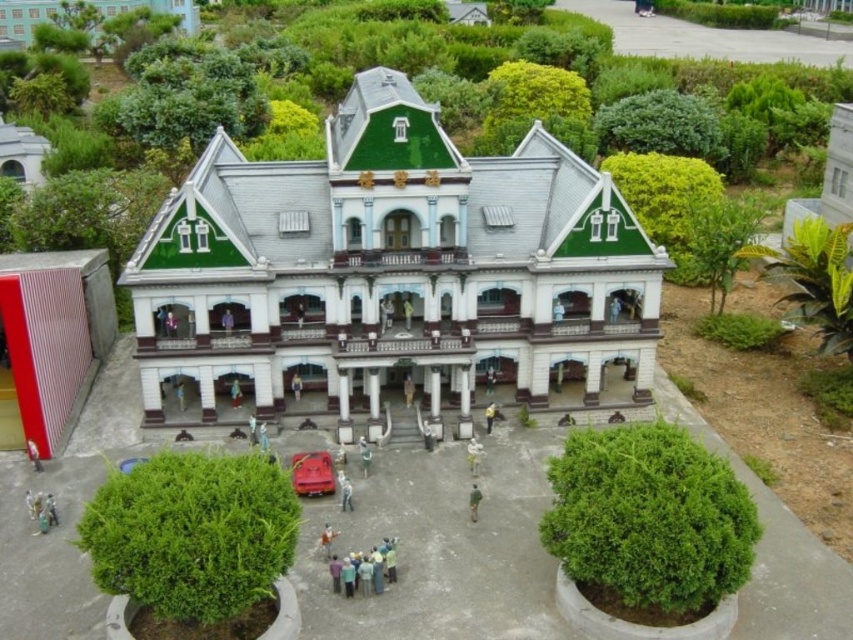
You are a visitor standing in front of the miniature model of the grand building. You see the light blue fabric group at lower center and the yellow fabric person at center. Which object is positioned lower in the scene?

The light blue fabric group at lower center is positioned lower than the yellow fabric person at center.

You are a visitor approaching the building and see the light brown wooden figure at center and the light brown wooden door at center. Which object appears shorter in the scene?

The light brown wooden figure at center is shorter than the light brown wooden door at center.